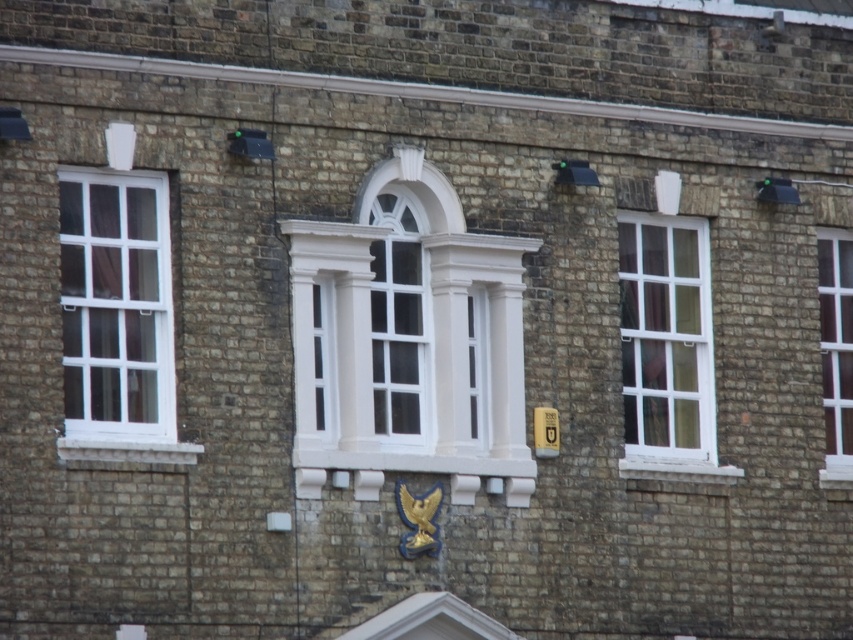
What are the coordinates of the white glossy window at center?

The white glossy window at center is located at coordinates point [407,340].

Looking at this image, you are standing in front of a brick building with three windows. You notice the white glossy window at center and the white plastic window at left. Which window is located to the right of the other?

The white glossy window at center is positioned on the right side of the white plastic window at left.

You are standing in front of a brick building and want to determine which window is closer to you. You see the white glossy window at center and the white plastic window at left. Which one is closer?

The white glossy window at center is closer to you because it is positioned further to the viewer than the white plastic window at left.